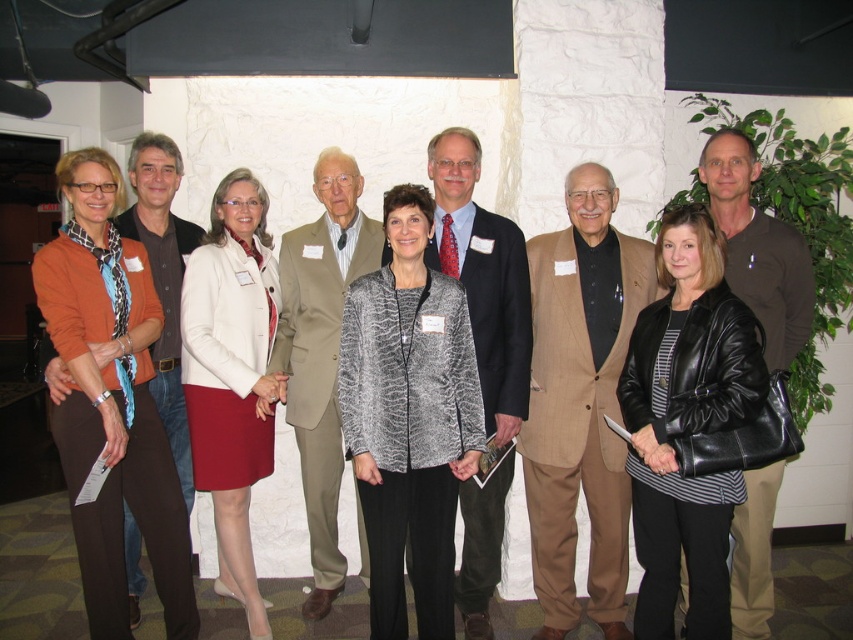
Question: Does textured gray blazer at center lie in front of tan pinstripe suit at center?

Choices:
 (A) yes
 (B) no

Answer: (A)

Question: Can you confirm if matte orange sweater at left is smaller than light brown suit at center?

Choices:
 (A) yes
 (B) no

Answer: (A)

Question: Estimate the real-world distances between objects in this image. Which object is farther from the matte orange sweater at left?

Choices:
 (A) brown leather jacket at center
 (B) black leather jacket at center

Answer: (A)

Question: Considering the relative positions of matte black jacket at center and brown leather jacket at center in the image provided, where is matte black jacket at center located with respect to brown leather jacket at center?

Choices:
 (A) above
 (B) below

Answer: (B)

Question: Which object appears farthest from the camera in this image?

Choices:
 (A) matte black jacket at center
 (B) black leather jacket at center

Answer: (A)

Question: Which object is closer to the camera taking this photo?

Choices:
 (A) matte black jacket at center
 (B) white textured blazer at center
 (C) textured gray blazer at center
 (D) black leather jacket at center

Answer: (D)